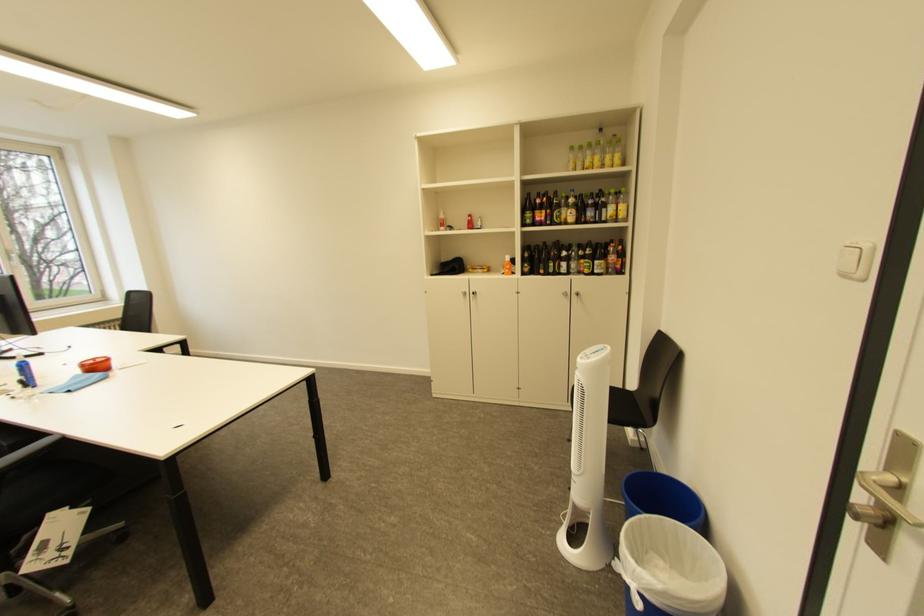
Describe the element at coordinates (669, 569) in the screenshot. I see `a white trash can` at that location.